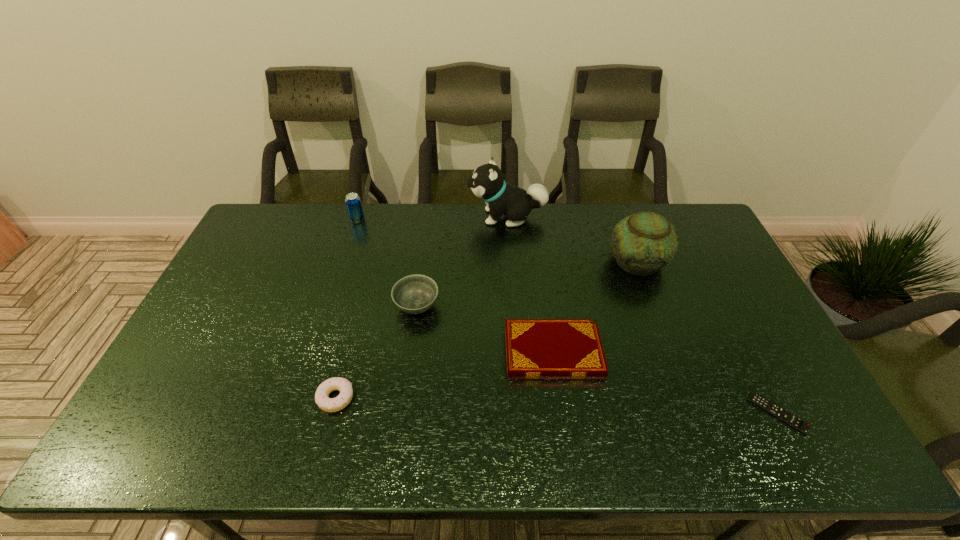
Find the location of `free space located 0.400m on the left of the doughnut`. free space located 0.400m on the left of the doughnut is located at coordinates (160, 398).

Where is `vacant space situated 0.330m on the left of the remote control`? This screenshot has height=540, width=960. vacant space situated 0.330m on the left of the remote control is located at coordinates (620, 413).

Where is `puppy present at the far edge`? The image size is (960, 540). puppy present at the far edge is located at coordinates (487, 182).

I want to click on pottery that is positioned at the far edge, so click(x=644, y=242).

Locate an element on the screen. Image resolution: width=960 pixels, height=540 pixels. beer can that is at the far edge is located at coordinates (353, 202).

The image size is (960, 540). Find the location of `object situated at the near edge`. object situated at the near edge is located at coordinates (776, 411).

In order to click on object that is at the right edge in this screenshot , I will do `click(776, 411)`.

Where is `object at the near right corner`? The height and width of the screenshot is (540, 960). object at the near right corner is located at coordinates (776, 411).

The width and height of the screenshot is (960, 540). In the image, there is a desktop. What are the coordinates of `free space at the far edge` in the screenshot? It's located at (444, 215).

In the image, there is a desktop. Where is `vacant space at the near edge`? This screenshot has width=960, height=540. vacant space at the near edge is located at coordinates (522, 434).